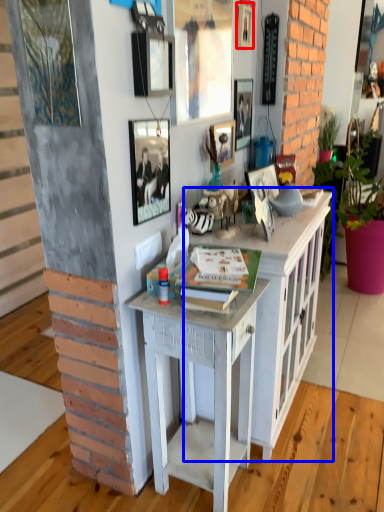
Question: Which object appears farthest to the camera in this image, picture frame (highlighted by a red box) or cabinetry (highlighted by a blue box)?

Choices:
 (A) picture frame
 (B) cabinetry

Answer: (A)